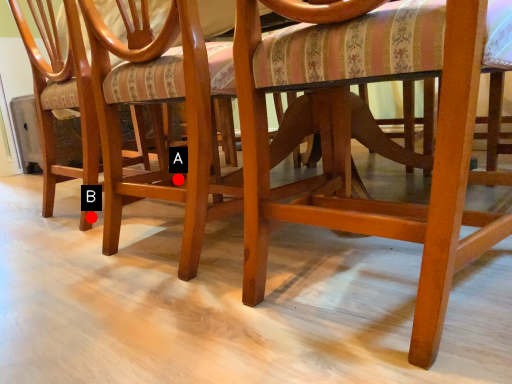
Question: Two points are circled on the image, labeled by A and B beside each circle. Which point is closer to the camera?

Choices:
 (A) A is closer
 (B) B is closer

Answer: (B)